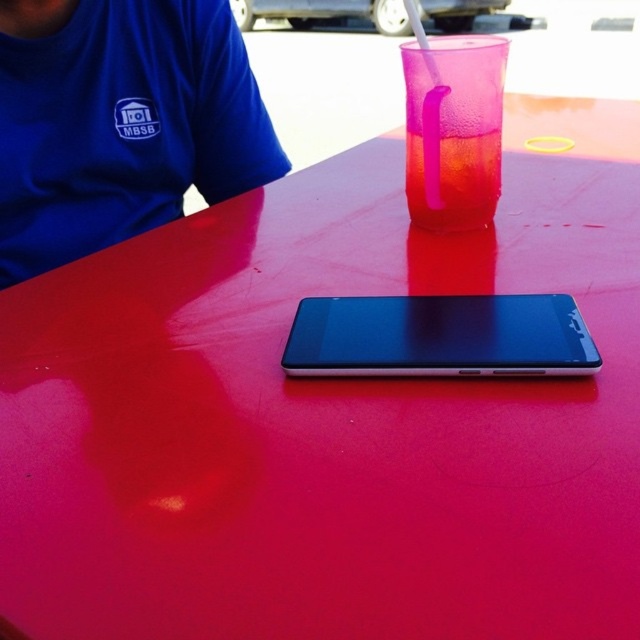
From the picture: You are a delivery person who needs to place a small package on the table. The package is 10 cm wide. The table has the sleek black phone at center and the translucent pink drink at upper center. Which object must you move to make space for the package?

You must move the sleek black phone at center because its width is greater than the translucent pink drink at upper center, so it occupies more space. Since the package is 10 cm wide, moving the wider object would free up enough space.

You are holding a 12 inch ruler and want to measure the distance between yourself and the sleek black phone at center. Can you reach it without moving your hand?

The distance between you and the sleek black phone at center is 11.62 inches, which is slightly less than your 12 inch ruler. Therefore, you can reach it without moving your hand.